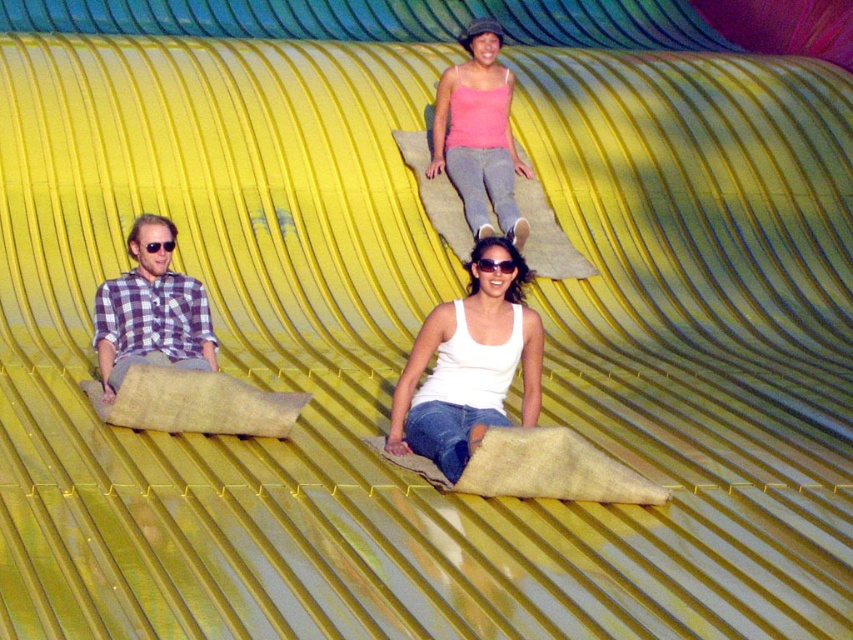
Is point (485, 371) positioned after point (128, 234)?

No, it is in front of (128, 234).

Who is more distant from viewer, (x=492, y=392) or (x=140, y=291)?

Positioned behind is point (x=140, y=291).

Does point (514, 358) lie behind point (148, 250)?

No, it is in front of (148, 250).

Locate an element on the screen. The height and width of the screenshot is (640, 853). white matte tank top at center is located at coordinates (469, 364).

Can you confirm if pink cotton tank top at upper center is shorter than plaid shirt at left?

No, pink cotton tank top at upper center is not shorter than plaid shirt at left.

Is pink cotton tank top at upper center further to camera compared to plaid shirt at left?

Yes, pink cotton tank top at upper center is behind plaid shirt at left.

Which is behind, point (512, 211) or point (213, 340)?

The point (512, 211) is behind.

This screenshot has height=640, width=853. I want to click on pink cotton tank top at upper center, so click(479, 134).

Does white matte tank top at center have a greater width compared to pink cotton tank top at upper center?

No, white matte tank top at center is not wider than pink cotton tank top at upper center.

Can you confirm if white matte tank top at center is thinner than pink cotton tank top at upper center?

Indeed, white matte tank top at center has a lesser width compared to pink cotton tank top at upper center.

This screenshot has width=853, height=640. In order to click on white matte tank top at center in this screenshot , I will do `click(469, 364)`.